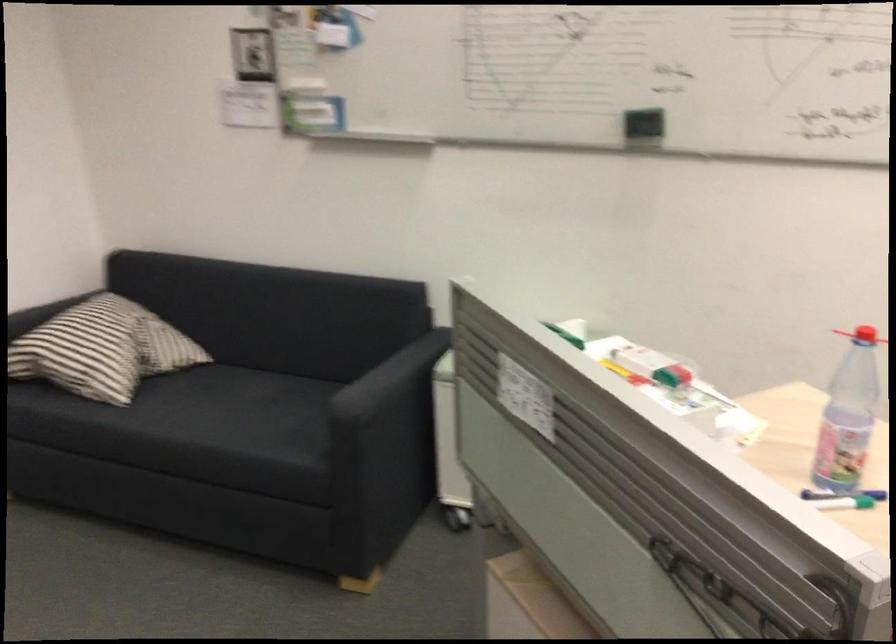
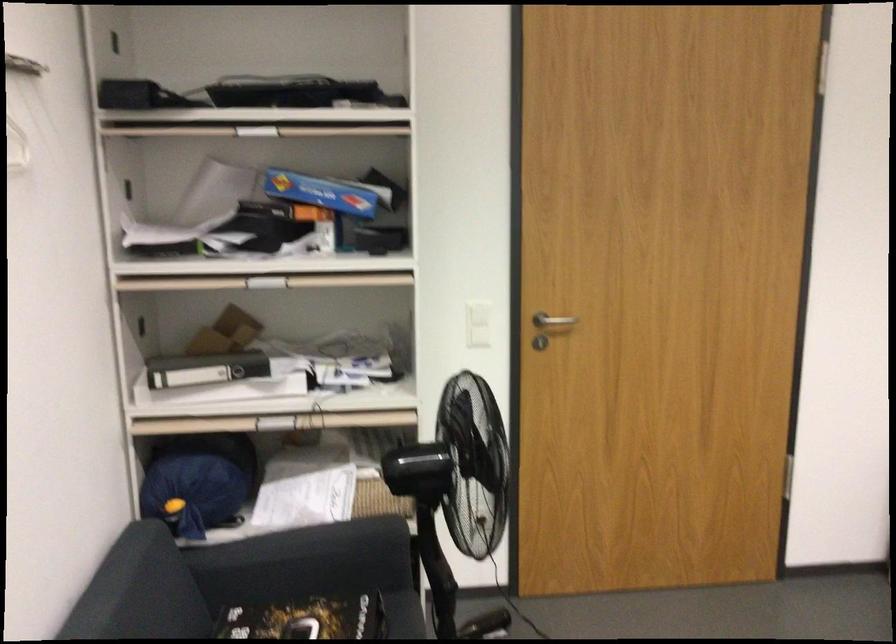
Question: The camera is either moving clockwise (left) or counter-clockwise (right) around the object. The first image is from the beginning of the video and the second image is from the end. Is the camera moving left or right when shooting the video?

Choices:
 (A) Left
 (B) Right

Answer: (B)